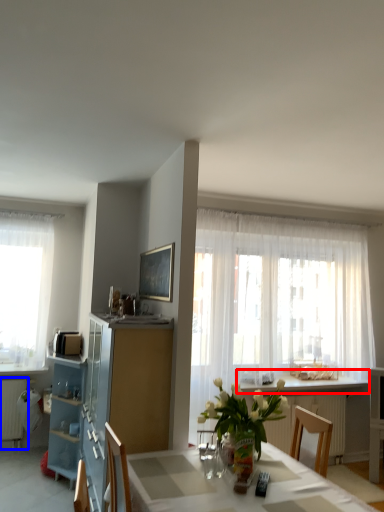
Question: Which point is closer to the camera, counter top (highlighted by a red box) or radiator (highlighted by a blue box)?

Choices:
 (A) counter top
 (B) radiator

Answer: (A)